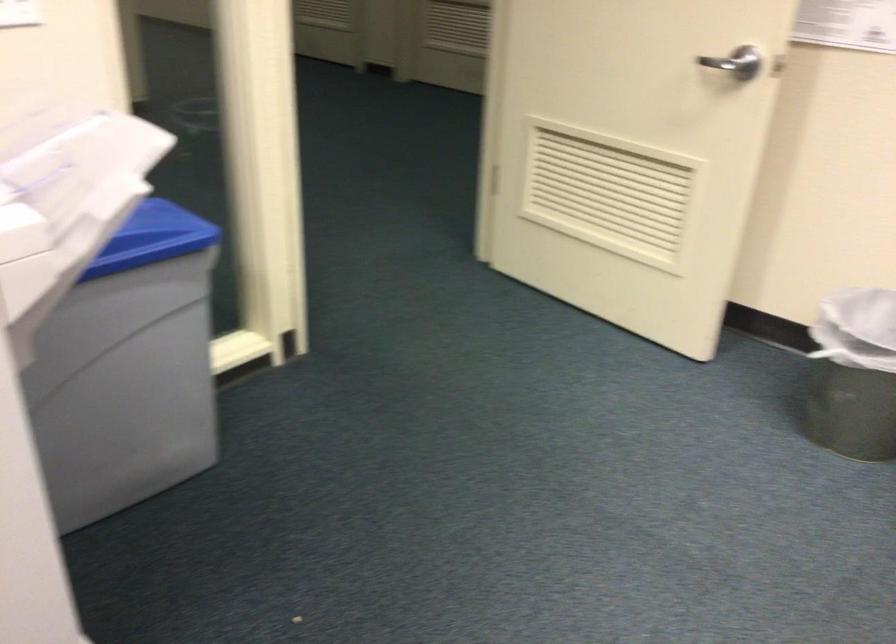
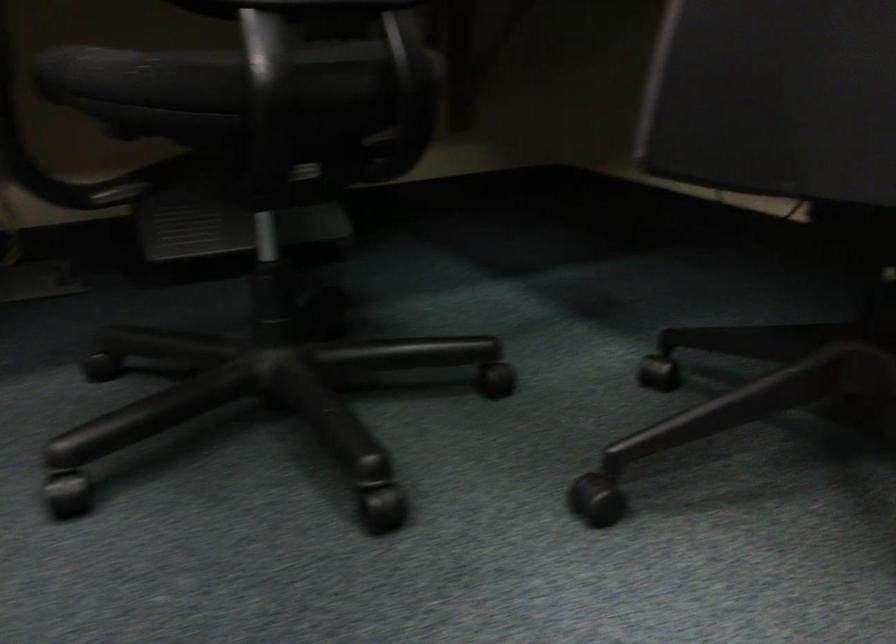
Question: The first image is from the beginning of the video and the second image is from the end. How did the camera likely rotate when shooting the video?

Choices:
 (A) Left
 (B) Right
 (C) Up
 (D) Down

Answer: (B)